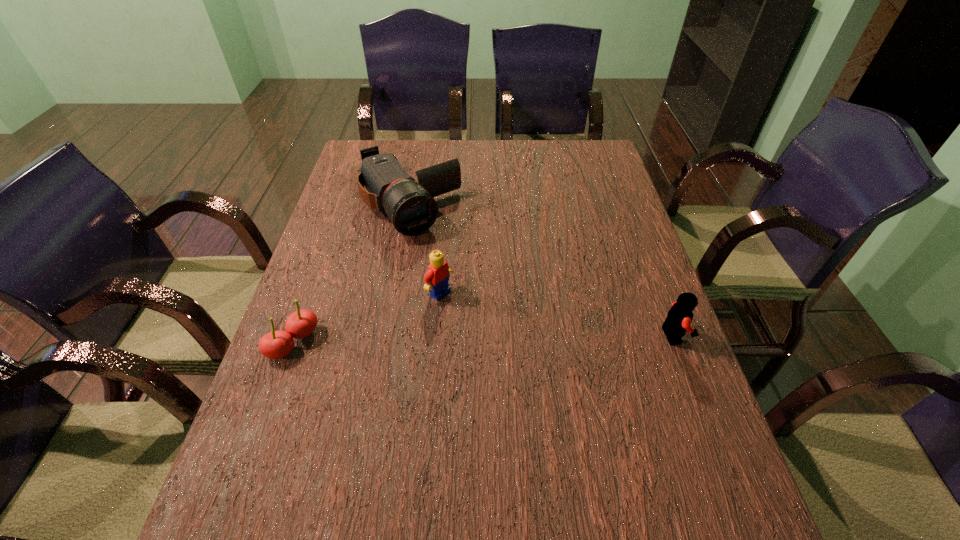
Identify the location of vacant space that is in between the farthest object and the cherry. (351, 274).

Find the location of a particular element. The height and width of the screenshot is (540, 960). free space between the left Lego and the farthest object is located at coordinates (424, 249).

Where is `vacant area between the camcorder and the right Lego`? Image resolution: width=960 pixels, height=540 pixels. vacant area between the camcorder and the right Lego is located at coordinates (541, 271).

Find the location of a particular element. The height and width of the screenshot is (540, 960). object that is the third closest to the shortest object is located at coordinates (678, 321).

Point out which object is positioned as the nearest to the shortest object. Please provide its 2D coordinates. Your answer should be formatted as a tuple, i.e. [(x, y)], where the tuple contains the x and y coordinates of a point satisfying the conditions above.

[(436, 278)]

Find the location of a particular element. The image size is (960, 540). free location that satisfies the following two spatial constraints: 1. on the front side of the right Lego; 2. on the front-facing side of the third nearest object is located at coordinates (437, 335).

Find the location of a particular element. vacant space that satisfies the following two spatial constraints: 1. on the back side of the cherry; 2. on the right side of the camcorder is located at coordinates (342, 207).

Where is `free space that satisfies the following two spatial constraints: 1. on the front side of the nearer Lego; 2. on the front-facing side of the farthest object`? The image size is (960, 540). free space that satisfies the following two spatial constraints: 1. on the front side of the nearer Lego; 2. on the front-facing side of the farthest object is located at coordinates (386, 335).